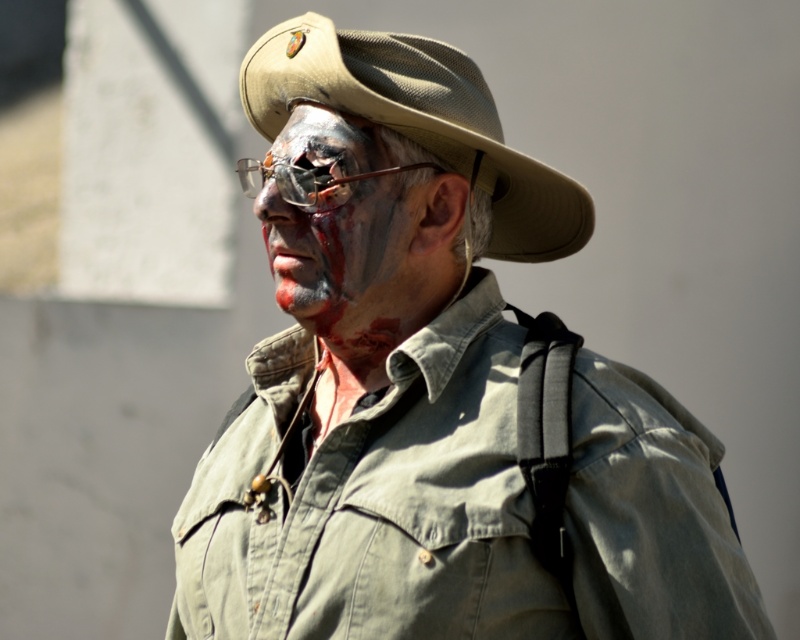
Question: Is tan fabric fedora at center smaller than matte gray face at center?

Choices:
 (A) no
 (B) yes

Answer: (A)

Question: Observing the image, what is the correct spatial positioning of tan fabric fedora at center in reference to matte gray face at center?

Choices:
 (A) right
 (B) left

Answer: (A)

Question: Is tan fabric fedora at center to the right of matte gray face at center from the viewer's perspective?

Choices:
 (A) no
 (B) yes

Answer: (B)